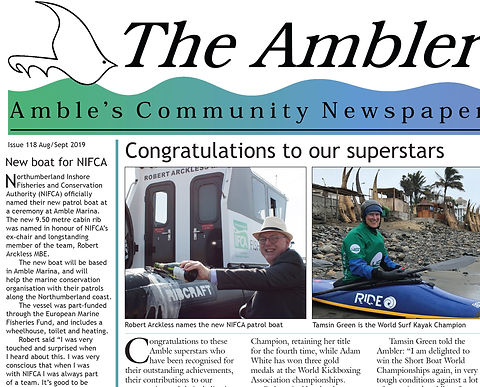
What are the coordinates of `windows` in the screenshot? It's located at (163, 206), (204, 205), (256, 202), (273, 195), (247, 178).